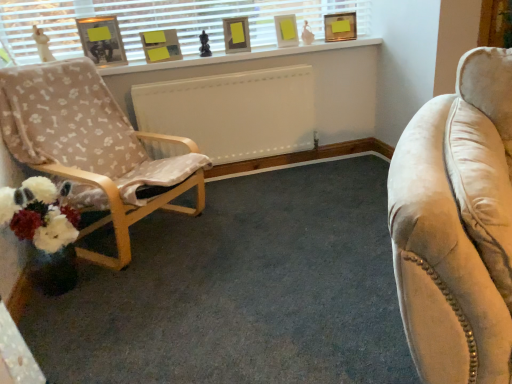
Question: Are matte white picture frame at upper center, marked as the 4th picture frame in a left-to-right arrangement, and matte black picture frame at upper left, the fifth picture frame in the right-to-left sequence, far apart?

Choices:
 (A) no
 (B) yes

Answer: (B)

Question: Does matte white picture frame at upper center, arranged as the second picture frame when viewed from the right, have a greater width compared to matte black picture frame at upper left, the fifth picture frame in the right-to-left sequence?

Choices:
 (A) yes
 (B) no

Answer: (B)

Question: From the image's perspective, is matte white picture frame at upper center, marked as the 4th picture frame in a left-to-right arrangement, beneath matte black picture frame at upper left, the first picture frame in the left-to-right sequence?

Choices:
 (A) yes
 (B) no

Answer: (B)

Question: Is matte white picture frame at upper center, marked as the 4th picture frame in a left-to-right arrangement, looking in the opposite direction of matte black picture frame at upper left, the first picture frame in the left-to-right sequence?

Choices:
 (A) no
 (B) yes

Answer: (A)

Question: Is matte white picture frame at upper center, arranged as the second picture frame when viewed from the right, at the left side of matte black picture frame at upper left, the first picture frame in the left-to-right sequence?

Choices:
 (A) yes
 (B) no

Answer: (B)

Question: Is point (329, 34) closer or farther from the camera than point (73, 130)?

Choices:
 (A) farther
 (B) closer

Answer: (A)

Question: Is matte gold picture frame at upper center, positioned as the first picture frame in right-to-left order, inside or outside of wooden chair with bone-patterned fabric at left?

Choices:
 (A) inside
 (B) outside

Answer: (B)

Question: In the image, is matte gold picture frame at upper center, acting as the 5th picture frame starting from the left, positioned in front of or behind wooden chair with bone-patterned fabric at left?

Choices:
 (A) behind
 (B) front

Answer: (A)

Question: Considering the relative positions of matte gold picture frame at upper center, acting as the 5th picture frame starting from the left, and wooden chair with bone-patterned fabric at left in the image provided, is matte gold picture frame at upper center, acting as the 5th picture frame starting from the left, to the left or to the right of wooden chair with bone-patterned fabric at left?

Choices:
 (A) left
 (B) right

Answer: (B)

Question: Do you think matte white picture frame at upper center, arranged as the second picture frame when viewed from the right, is within wooden chair with bone-patterned fabric at left, or outside of it?

Choices:
 (A) inside
 (B) outside

Answer: (B)

Question: Considering the positions of matte white picture frame at upper center, arranged as the second picture frame when viewed from the right, and wooden chair with bone-patterned fabric at left in the image, is matte white picture frame at upper center, arranged as the second picture frame when viewed from the right, taller or shorter than wooden chair with bone-patterned fabric at left?

Choices:
 (A) short
 (B) tall

Answer: (A)

Question: Looking at their shapes, would you say matte white picture frame at upper center, marked as the 4th picture frame in a left-to-right arrangement, is wider or thinner than wooden chair with bone-patterned fabric at left?

Choices:
 (A) wide
 (B) thin

Answer: (B)

Question: Relative to wooden chair with bone-patterned fabric at left, is matte white picture frame at upper center, arranged as the second picture frame when viewed from the right, in front or behind?

Choices:
 (A) front
 (B) behind

Answer: (B)

Question: Is matte gold picture frame at upper center, acting as the 5th picture frame starting from the left, taller or shorter than matte white picture frame at upper center, marked as the 4th picture frame in a left-to-right arrangement?

Choices:
 (A) short
 (B) tall

Answer: (A)

Question: From the image's perspective, is matte gold picture frame at upper center, positioned as the first picture frame in right-to-left order, located above or below matte white picture frame at upper center, marked as the 4th picture frame in a left-to-right arrangement?

Choices:
 (A) below
 (B) above

Answer: (B)